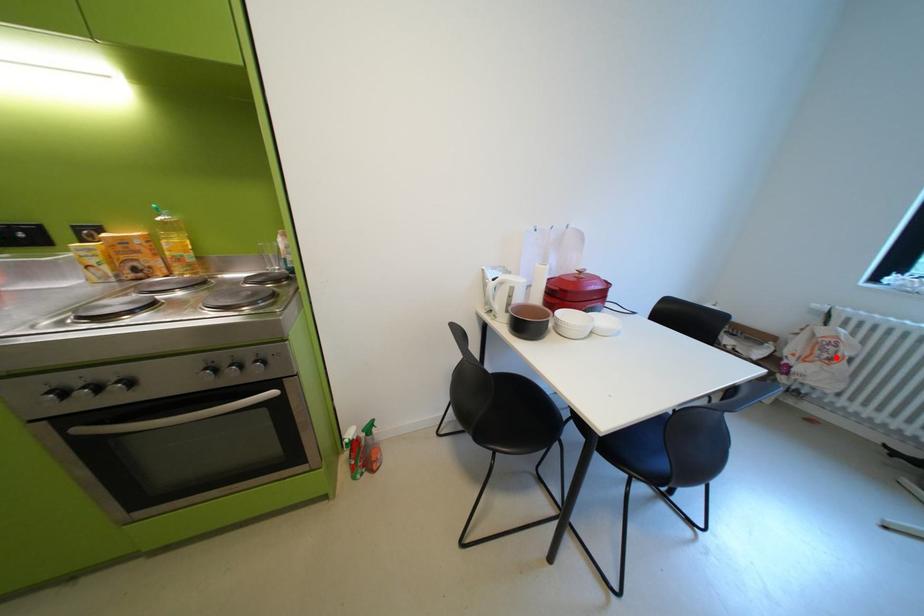
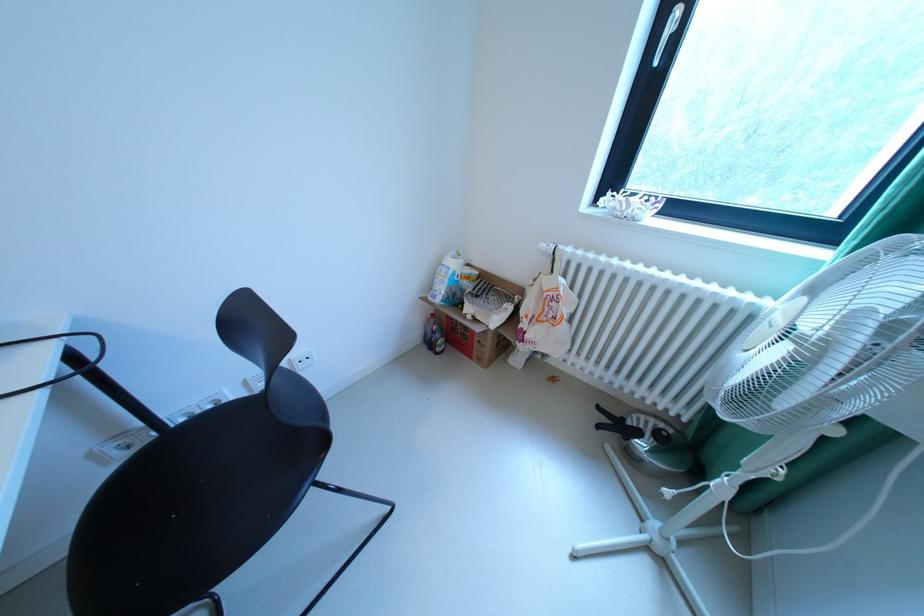
Question: I am providing you with two images of the same scene from different viewpoints. Image1 has a red point marked. In image2, the corresponding 3D location appears at what relative position? Reply with the corresponding letter.

Choices:
 (A) Closer
 (B) Farther

Answer: (A)